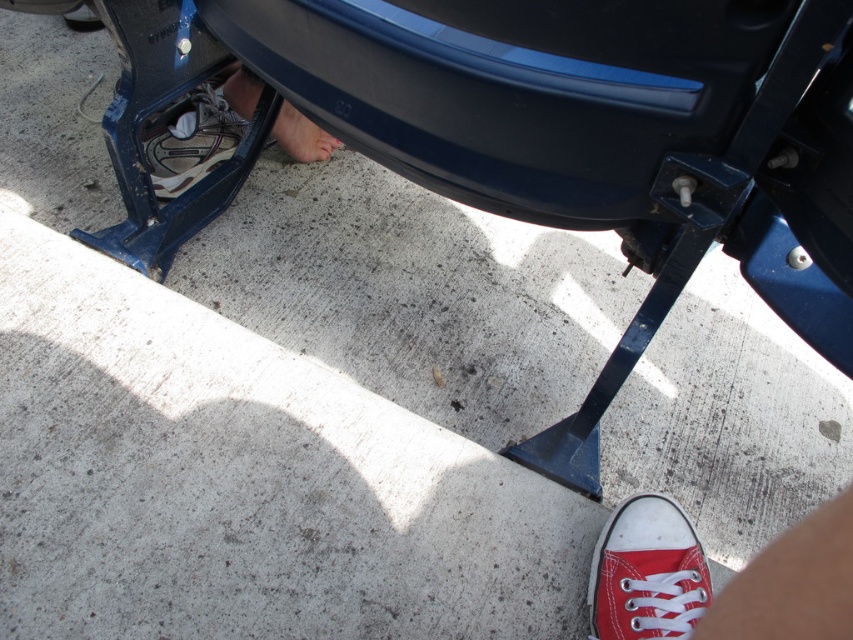
Which is below, leather/textured sneaker at lower left or smooth skin foot at center?

leather/textured sneaker at lower left is below.

Does leather/textured sneaker at lower left appear on the right side of smooth skin foot at center?

In fact, leather/textured sneaker at lower left is to the left of smooth skin foot at center.

You are a GUI agent. You are given a task and a screenshot of the screen. Output one action in this format:
    pyautogui.click(x=<x>, y=<y>)
    Task: Click on the leather/textured sneaker at lower left
    The width and height of the screenshot is (853, 640).
    Given the screenshot: What is the action you would take?
    pyautogui.click(x=190, y=138)

Is point (701, 602) behind point (279, 116)?

No, it is not.

Is the position of red canvas shoe at lower right more distant than that of smooth skin foot at center?

No, red canvas shoe at lower right is closer to the viewer.

At what (x,y) coordinates should I click in order to perform the action: click on red canvas shoe at lower right. Please return your answer as a coordinate pair (x, y). The height and width of the screenshot is (640, 853). Looking at the image, I should click on (647, 572).

Can you confirm if red canvas shoe at lower right is positioned below leather/textured sneaker at lower left?

Correct, red canvas shoe at lower right is located below leather/textured sneaker at lower left.

Is red canvas shoe at lower right shorter than leather/textured sneaker at lower left?

Correct, red canvas shoe at lower right is not as tall as leather/textured sneaker at lower left.

The width and height of the screenshot is (853, 640). Describe the element at coordinates (647, 572) in the screenshot. I see `red canvas shoe at lower right` at that location.

In order to click on red canvas shoe at lower right in this screenshot , I will do `click(647, 572)`.